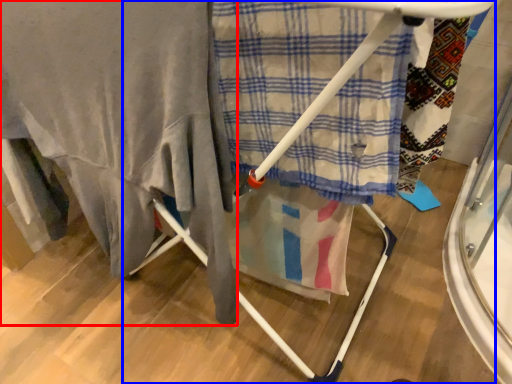
Question: Which object appears farthest to the camera in this image, blanket (highlighted by a red box) or furniture (highlighted by a blue box)?

Choices:
 (A) blanket
 (B) furniture

Answer: (A)